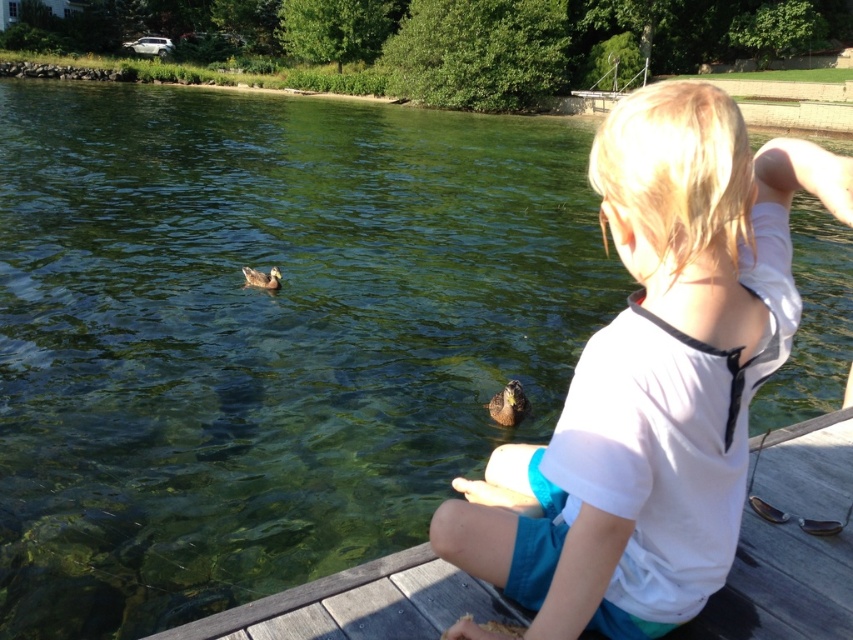
You are standing on the wooden dock at lower center and want to throw a small pebble to reach the brown matte duck at left without hitting anything else. Considering their distance, is it possible to do so?

The wooden dock at lower center and brown matte duck at left are 6.57 meters apart. Since the distance is sufficient, you can throw the pebble to reach the brown matte duck at left without hitting anything else.

From the picture: You are a photographer trying to capture a closeup shot of both the brown fuzzy duck at lower center and the brown matte duck at left. Given that your camera can focus on objects within a 4 meter range, will you be able to photograph both ducks in one frame?

The distance between the brown fuzzy duck at lower center and the brown matte duck at left is 4.17 meters, which exceeds the camera focus range of 4 meters. Therefore, you cannot photograph both ducks in one frame.